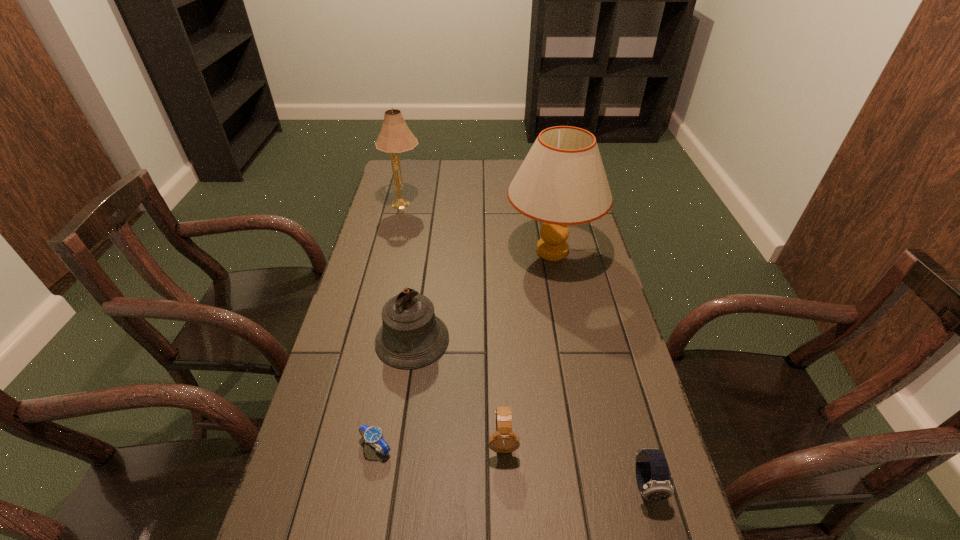
The image size is (960, 540). In order to click on the nearer lampshade in this screenshot , I will do `click(562, 181)`.

Where is `the right lampshade`? The width and height of the screenshot is (960, 540). the right lampshade is located at coordinates (562, 181).

At what (x,y) coordinates should I click in order to perform the action: click on the left lampshade. Please return your answer as a coordinate pair (x, y). Looking at the image, I should click on (395, 137).

In order to click on the farthest object in this screenshot , I will do `click(395, 137)`.

Find the location of `the third tallest object`. the third tallest object is located at coordinates (411, 336).

Image resolution: width=960 pixels, height=540 pixels. Find the location of `the fourth nearest object`. the fourth nearest object is located at coordinates (411, 336).

Locate an element on the screen. This screenshot has width=960, height=540. the second watch from left to right is located at coordinates (504, 440).

Locate an element on the screen. This screenshot has height=540, width=960. the rightmost watch is located at coordinates (652, 473).

Locate an element on the screen. the nearest watch is located at coordinates (652, 473).

The image size is (960, 540). What are the coordinates of `the shortest watch` in the screenshot? It's located at (373, 435).